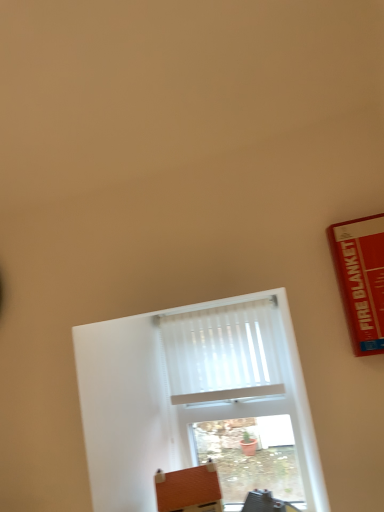
Question: From the image's perspective, would you say white pleated curtain at center is shown under white matte window at center?

Choices:
 (A) yes
 (B) no

Answer: (B)

Question: Does white pleated curtain at center have a larger size compared to white matte window at center?

Choices:
 (A) yes
 (B) no

Answer: (B)

Question: From a real-world perspective, is white pleated curtain at center located higher than white matte window at center?

Choices:
 (A) no
 (B) yes

Answer: (B)

Question: Is white pleated curtain at center aimed at white matte window at center?

Choices:
 (A) no
 (B) yes

Answer: (A)

Question: Considering the relative sizes of white pleated curtain at center and white matte window at center in the image provided, is white pleated curtain at center wider than white matte window at center?

Choices:
 (A) yes
 (B) no

Answer: (B)

Question: Can you see white pleated curtain at center touching white matte window at center?

Choices:
 (A) no
 (B) yes

Answer: (B)

Question: Is brown leather cushion at lower center in contact with white matte window at center?

Choices:
 (A) yes
 (B) no

Answer: (B)

Question: Is white matte window at center surrounded by brown leather cushion at lower center?

Choices:
 (A) no
 (B) yes

Answer: (A)

Question: Is brown leather cushion at lower center thinner than white matte window at center?

Choices:
 (A) yes
 (B) no

Answer: (B)

Question: From the image's perspective, is brown leather cushion at lower center on top of white matte window at center?

Choices:
 (A) yes
 (B) no

Answer: (B)

Question: Considering the relative sizes of brown leather cushion at lower center and white matte window at center in the image provided, is brown leather cushion at lower center shorter than white matte window at center?

Choices:
 (A) no
 (B) yes

Answer: (B)

Question: Considering the relative sizes of brown leather cushion at lower center and white matte window at center in the image provided, is brown leather cushion at lower center taller than white matte window at center?

Choices:
 (A) no
 (B) yes

Answer: (A)

Question: Is white matte window at center wider than brown leather cushion at lower center?

Choices:
 (A) yes
 (B) no

Answer: (B)